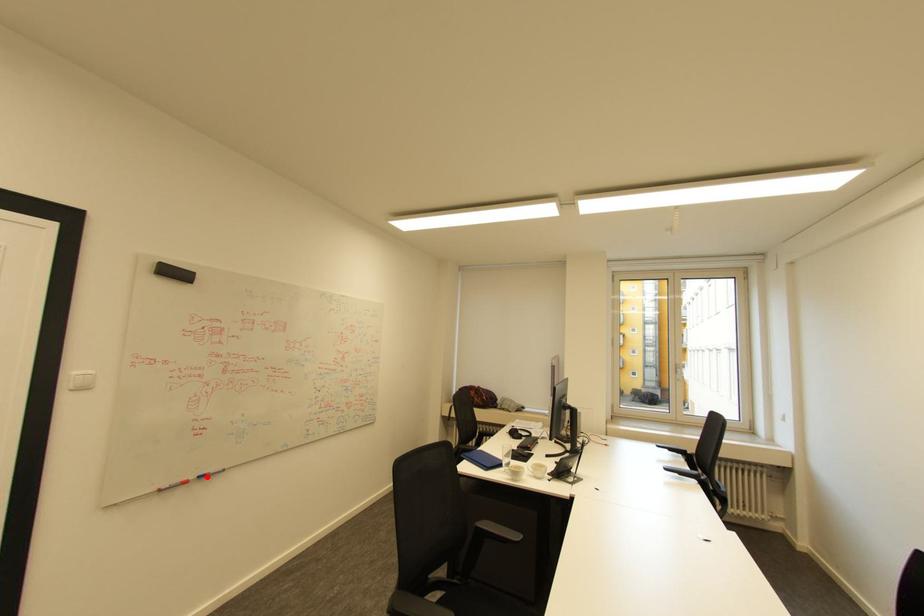
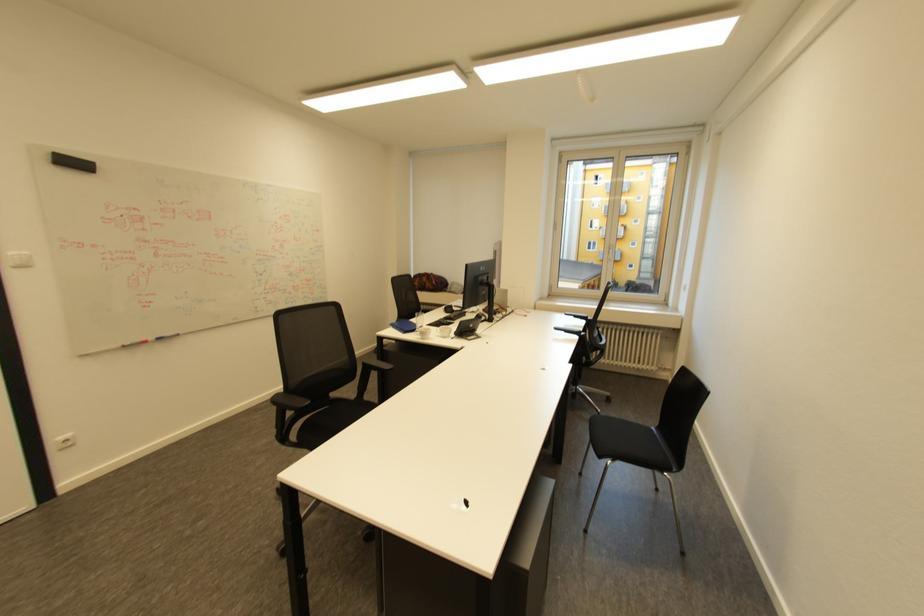
The point at the highlighted location is marked in the first image. Where is the corresponding point in the second image?

(164, 339)